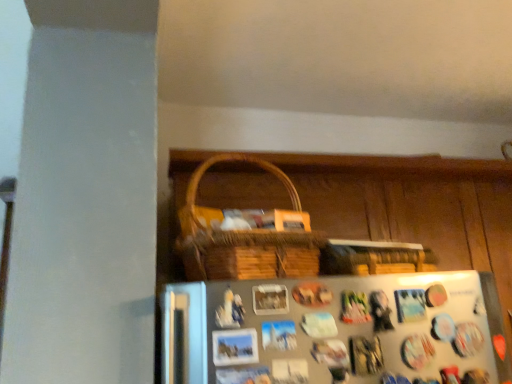
What do you see at coordinates (324, 316) in the screenshot? I see `woven wood basket at upper center` at bounding box center [324, 316].

Where is `woven wood basket at upper center`? The height and width of the screenshot is (384, 512). woven wood basket at upper center is located at coordinates (324, 316).

Locate an element on the screen. metallic silver fridge at lower center is located at coordinates (336, 330).

Image resolution: width=512 pixels, height=384 pixels. What do you see at coordinates (336, 330) in the screenshot?
I see `metallic silver fridge at lower center` at bounding box center [336, 330].

In the scene shown: In order to face metallic silver fridge at lower center, should I rotate leftwards or rightwards?

A 15.093 degree turn to the right will do.

You are a GUI agent. You are given a task and a screenshot of the screen. Output one action in this format:
    pyautogui.click(x=<x>, y=<y>)
    Task: Click on the woven wood basket at upper center
    The height and width of the screenshot is (384, 512).
    Given the screenshot: What is the action you would take?
    tap(324, 316)

Can you confirm if metallic silver fridge at lower center is positioned to the right of woven wood basket at upper center?

In fact, metallic silver fridge at lower center is to the left of woven wood basket at upper center.

Is metallic silver fridge at lower center further to camera compared to woven wood basket at upper center?

No.

Does point (339, 330) come closer to viewer compared to point (401, 271)?

Yes, point (339, 330) is in front of point (401, 271).

From the image's perspective, which is below, metallic silver fridge at lower center or woven wood basket at upper center?

woven wood basket at upper center.

From a real-world perspective, between metallic silver fridge at lower center and woven wood basket at upper center, who is vertically lower?

metallic silver fridge at lower center, from a real-world perspective.

Considering the sizes of objects metallic silver fridge at lower center and woven wood basket at upper center in the image provided, who is wider, metallic silver fridge at lower center or woven wood basket at upper center?

woven wood basket at upper center is wider.

Can you confirm if metallic silver fridge at lower center is taller than woven wood basket at upper center?

Incorrect, the height of metallic silver fridge at lower center is not larger of that of woven wood basket at upper center.

Considering the sizes of objects metallic silver fridge at lower center and woven wood basket at upper center in the image provided, who is bigger, metallic silver fridge at lower center or woven wood basket at upper center?

woven wood basket at upper center is bigger.

Is metallic silver fridge at lower center completely or partially outside of woven wood basket at upper center?

metallic silver fridge at lower center lies outside woven wood basket at upper center's area.

Is metallic silver fridge at lower center touching woven wood basket at upper center?

No, metallic silver fridge at lower center is not next to woven wood basket at upper center.

Is metallic silver fridge at lower center aimed at woven wood basket at upper center?

No, metallic silver fridge at lower center is not aimed at woven wood basket at upper center.

What's the angular difference between metallic silver fridge at lower center and woven wood basket at upper center's facing directions?

0.569 degrees.

You are a GUI agent. You are given a task and a screenshot of the screen. Output one action in this format:
    pyautogui.click(x=<x>, y=<y>)
    Task: Click on the dresser behind the metallic silver fridge at lower center
    This screenshot has height=384, width=512.
    Given the screenshot: What is the action you would take?
    pyautogui.click(x=324, y=316)

Does woven wood basket at upper center appear on the left side of metallic silver fridge at lower center?

Incorrect, woven wood basket at upper center is not on the left side of metallic silver fridge at lower center.

Which is in front, woven wood basket at upper center or metallic silver fridge at lower center?

Positioned in front is metallic silver fridge at lower center.

Does point (325, 310) lie behind point (254, 371)?

Yes, point (325, 310) is farther from viewer.

From the image's perspective, would you say woven wood basket at upper center is positioned over metallic silver fridge at lower center?

Actually, woven wood basket at upper center appears below metallic silver fridge at lower center in the image.

From a real-world perspective, is woven wood basket at upper center positioned under metallic silver fridge at lower center based on gravity?

No, from a real-world perspective, woven wood basket at upper center is not beneath metallic silver fridge at lower center.

Does woven wood basket at upper center have a lesser width compared to metallic silver fridge at lower center?

No, woven wood basket at upper center is not thinner than metallic silver fridge at lower center.

Considering the sizes of objects woven wood basket at upper center and metallic silver fridge at lower center in the image provided, who is taller, woven wood basket at upper center or metallic silver fridge at lower center?

Standing taller between the two is woven wood basket at upper center.

Based on the photo, can you confirm if woven wood basket at upper center is bigger than metallic silver fridge at lower center?

Correct, woven wood basket at upper center is larger in size than metallic silver fridge at lower center.

Is woven wood basket at upper center inside the boundaries of metallic silver fridge at lower center, or outside?

woven wood basket at upper center is not enclosed by metallic silver fridge at lower center.

Are woven wood basket at upper center and metallic silver fridge at lower center located far from each other?

That's not correct — woven wood basket at upper center is a little close to metallic silver fridge at lower center.

Could you tell me if woven wood basket at upper center is facing metallic silver fridge at lower center?

Yes, woven wood basket at upper center is turned towards metallic silver fridge at lower center.

The width and height of the screenshot is (512, 384). I want to click on dresser behind the metallic silver fridge at lower center, so click(x=324, y=316).

The height and width of the screenshot is (384, 512). I want to click on refrigerator that is under the woven wood basket at upper center (from a real-world perspective), so click(336, 330).

This screenshot has width=512, height=384. Identify the location of refrigerator in front of the woven wood basket at upper center. (336, 330).